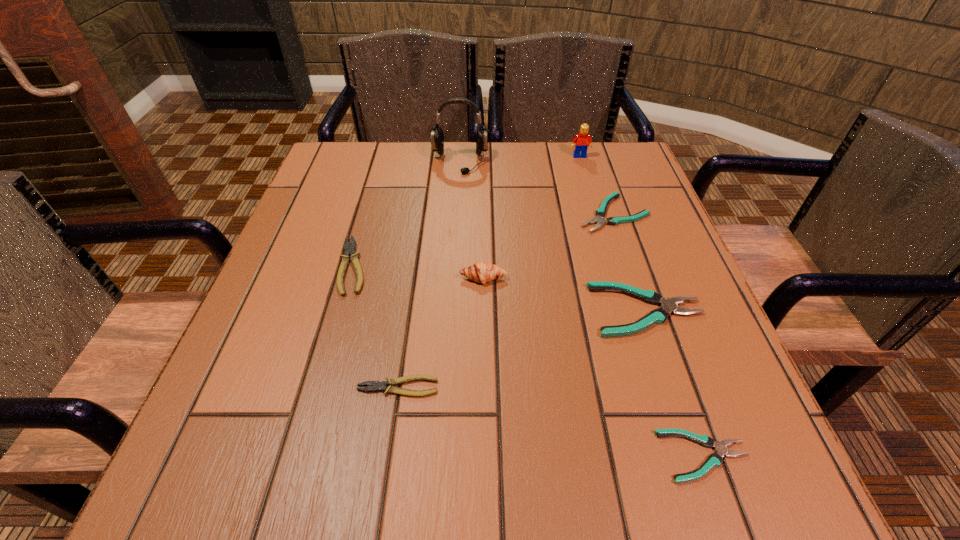
Image resolution: width=960 pixels, height=540 pixels. What are the coordinates of `vacant space at the left edge of the desktop` in the screenshot? It's located at (256, 399).

In the image, there is a desktop. Where is `vacant space at the right edge`? vacant space at the right edge is located at coordinates (740, 413).

Locate an element on the screen. The image size is (960, 540). vacant space at the far left corner of the desktop is located at coordinates pos(334,188).

You are a GUI agent. You are given a task and a screenshot of the screen. Output one action in this format:
    pyautogui.click(x=<x>, y=<y>)
    Task: Click on the vacant region at the far right corner
    This screenshot has width=960, height=540.
    Given the screenshot: What is the action you would take?
    pyautogui.click(x=634, y=174)

Find the location of a particular element. vacant space at the near right corner of the desktop is located at coordinates (792, 501).

The width and height of the screenshot is (960, 540). What are the coordinates of `vacant area that lies between the leftmost object and the sixth nearest object` in the screenshot? It's located at (483, 239).

Identify the location of free space between the headset and the nearest object. This screenshot has height=540, width=960. (582, 309).

Where is `vacant space that's between the pastry and the seventh farthest object`? Image resolution: width=960 pixels, height=540 pixels. vacant space that's between the pastry and the seventh farthest object is located at coordinates (441, 333).

At what (x,y) coordinates should I click in order to perform the action: click on free spot between the biggest teal pliers and the farthest teal pliers. Please return your answer as a coordinate pair (x, y). This screenshot has height=540, width=960. Looking at the image, I should click on (630, 262).

Find the location of `free spot between the seventh farthest object and the biggest teal pliers`. free spot between the seventh farthest object and the biggest teal pliers is located at coordinates (522, 349).